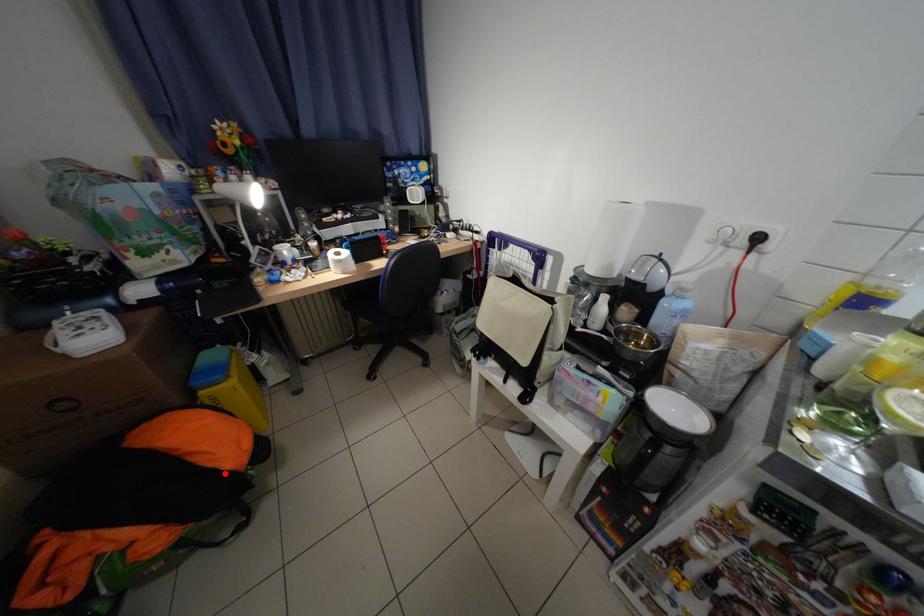
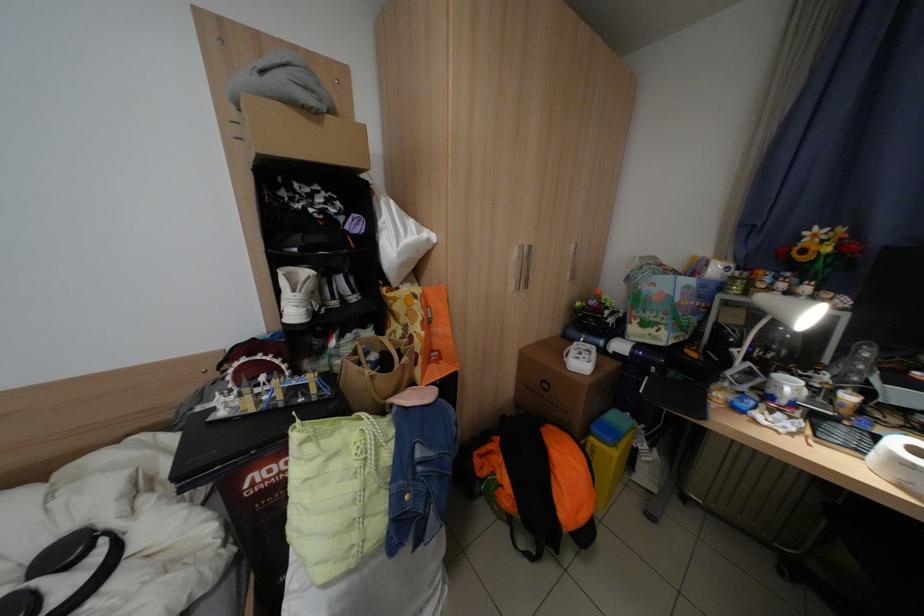
In the second image, find the point that corresponds to the highlighted location in the first image.

(565, 508)